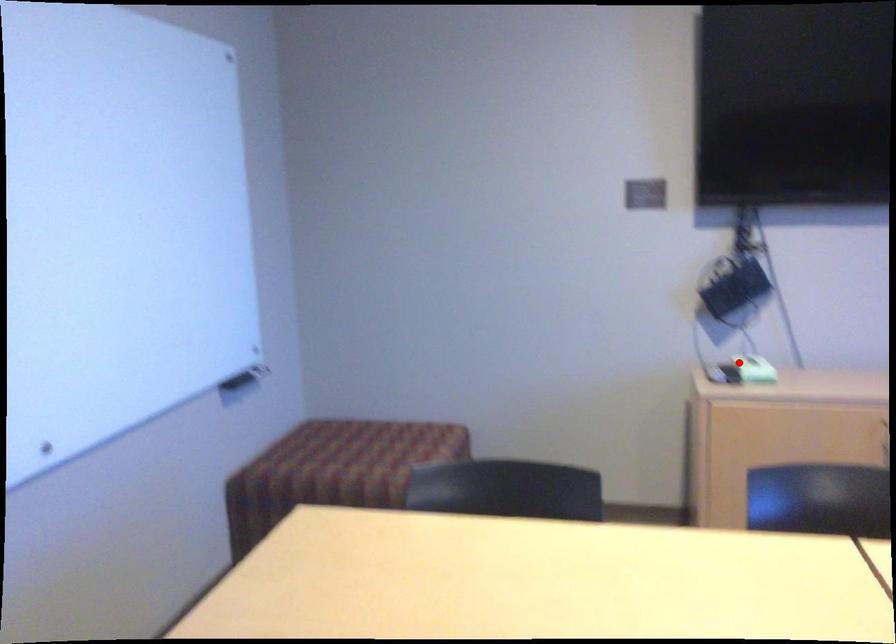
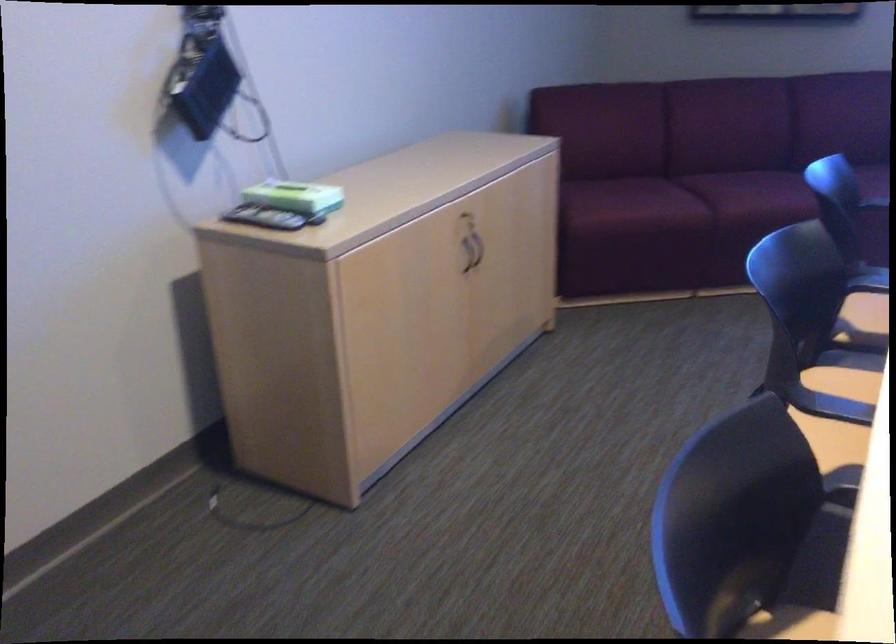
Question: I am providing you with two images of the same scene from different viewpoints. In image1, a red point is highlighted. Considering the same 3D point in image2, which of the following is correct?

Choices:
 (A) It is closer
 (B) It is farther

Answer: (A)